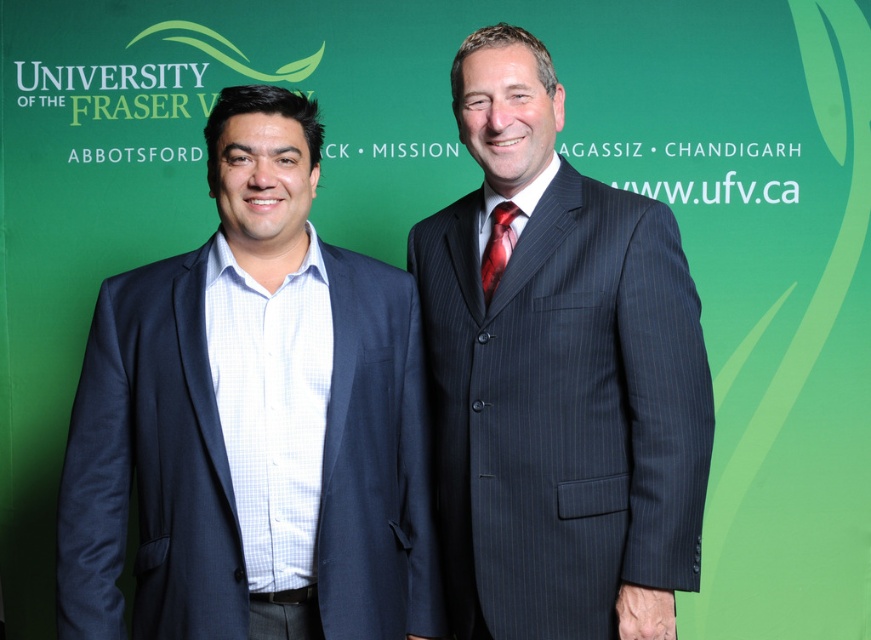
Can you confirm if navy blue suit at left is positioned to the right of shiny silk tie at center?

Incorrect, navy blue suit at left is not on the right side of shiny silk tie at center.

Can you confirm if navy blue suit at left is taller than shiny silk tie at center?

Indeed, navy blue suit at left has a greater height compared to shiny silk tie at center.

This screenshot has height=640, width=871. What do you see at coordinates (252, 420) in the screenshot? I see `navy blue suit at left` at bounding box center [252, 420].

Image resolution: width=871 pixels, height=640 pixels. Find the location of `navy blue suit at left`. navy blue suit at left is located at coordinates (252, 420).

Does pinstriped suit at center have a lesser width compared to shiny silk tie at center?

No, pinstriped suit at center is not thinner than shiny silk tie at center.

Between pinstriped suit at center and shiny silk tie at center, which one is positioned lower?

pinstriped suit at center is below.

This screenshot has width=871, height=640. I want to click on pinstriped suit at center, so click(558, 378).

Can you confirm if navy blue suit at left is bigger than pinstriped suit at center?

Actually, navy blue suit at left might be smaller than pinstriped suit at center.

The height and width of the screenshot is (640, 871). Find the location of `navy blue suit at left`. navy blue suit at left is located at coordinates (252, 420).